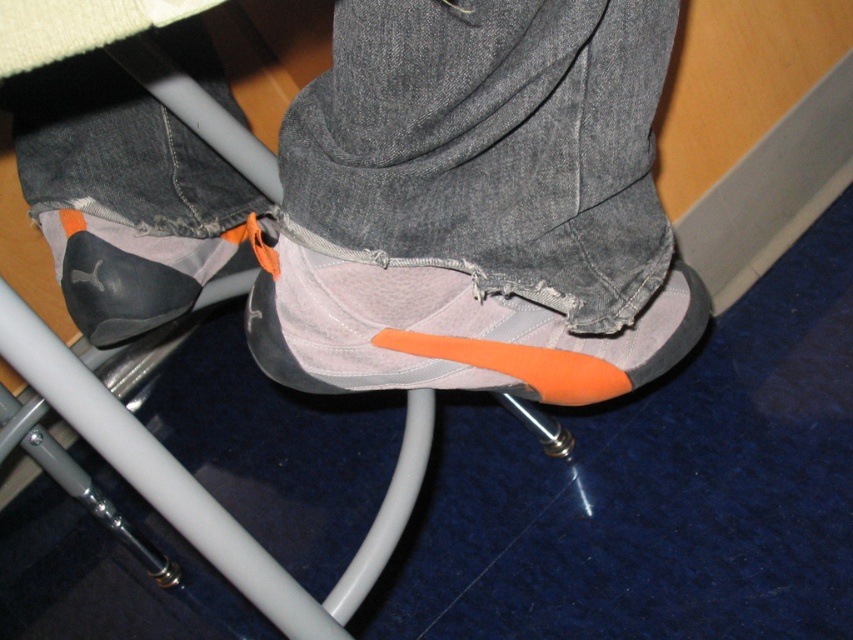
You are looking at the person in the image. There are two points marked on their legs and shoes. Which point is closer to you, point (570, 147) or point (386, 298)?

Point (570, 147) is closer to the viewer than point (386, 298).

You are trying to decide between two shoes to wear for a casual walk. You have a matte gray shoe at center and a matte black sneaker at lower center. Which one would be more comfortable for walking based on their height?

The matte gray shoe at center has a greater height compared to the matte black sneaker at lower center, so it might provide better cushioning and comfort for walking.

You are trying to decide which shoe to wear for a hike. You have two options in front of you on the chair. The matte gray shoe at center and the gray fabric shoe at center. Which one is more suitable for hiking based on their height?

The matte gray shoe at center is much taller than the gray fabric shoe at center, making it more suitable for hiking as taller shoes often provide better ankle support.